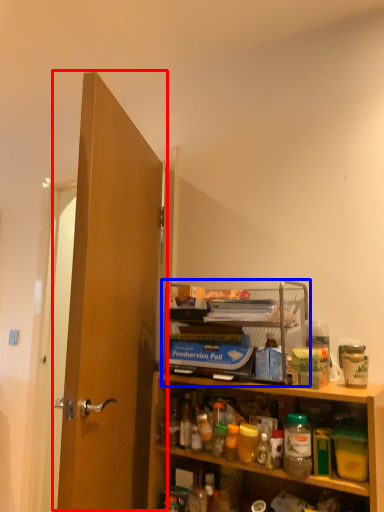
Question: Which object appears farthest to the camera in this image, door (highlighted by a red box) or shelf (highlighted by a blue box)?

Choices:
 (A) door
 (B) shelf

Answer: (B)